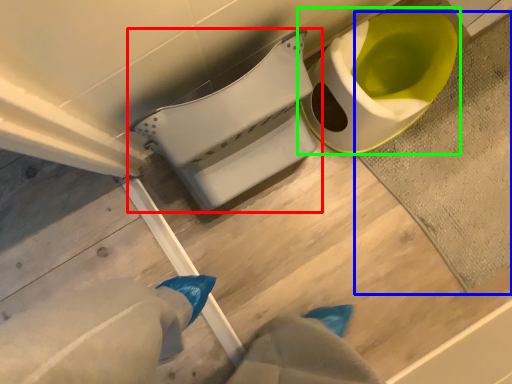
Question: Estimate the real-world distances between objects in this image. Which object is farther from toilet (highlighted by a red box), bath mat (highlighted by a blue box) or toilet (highlighted by a green box)?

Choices:
 (A) bath mat
 (B) toilet

Answer: (A)